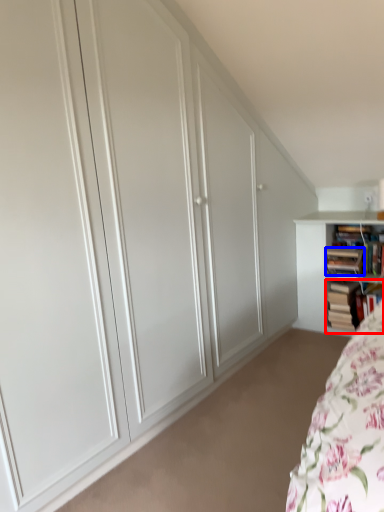
Question: Which point is further to the camera, book (highlighted by a red box) or book (highlighted by a blue box)?

Choices:
 (A) book
 (B) book

Answer: (A)